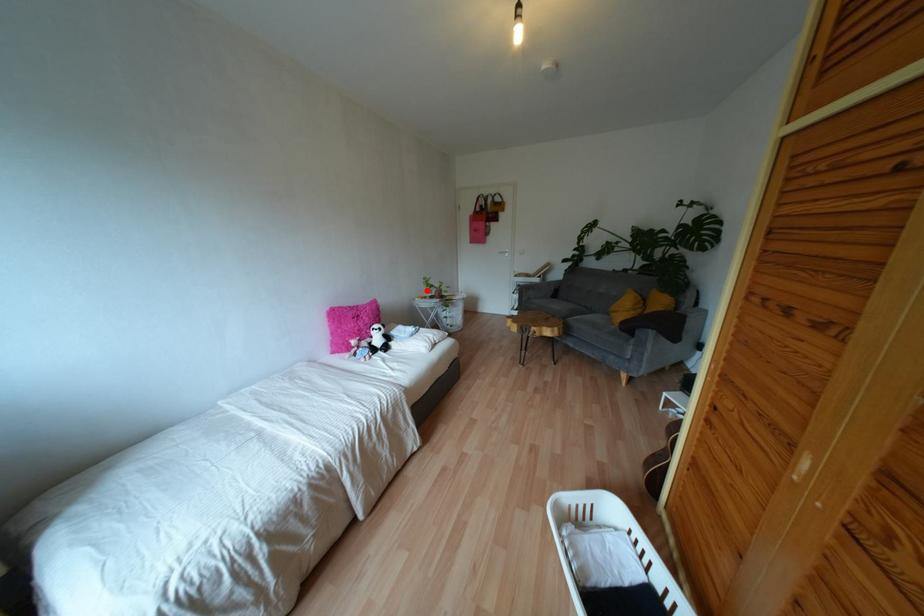
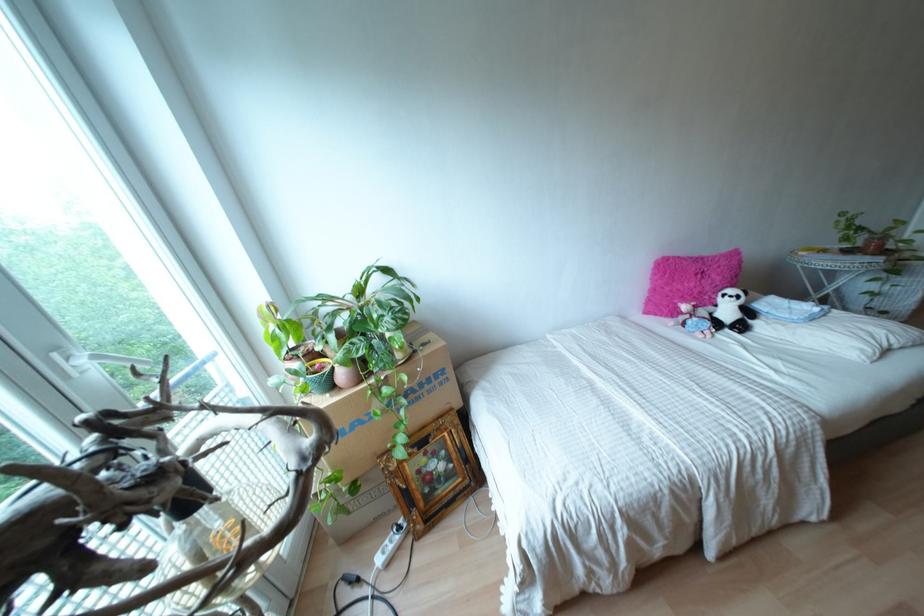
Where in the second image is the point corresponding to the highlighted location from the first image?

(845, 238)